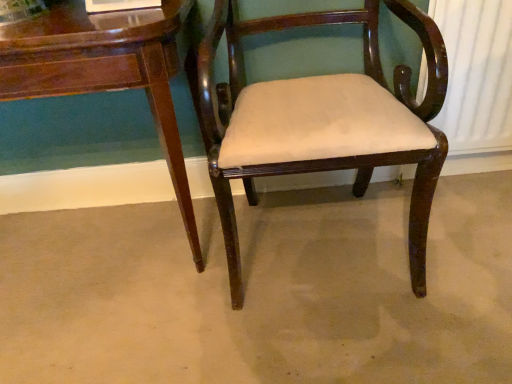
Question: From the image's perspective, is glossy wood table at lower left beneath mahogany wood chair at center?

Choices:
 (A) yes
 (B) no

Answer: (A)

Question: Considering the relative sizes of glossy wood table at lower left and mahogany wood chair at center in the image provided, is glossy wood table at lower left wider than mahogany wood chair at center?

Choices:
 (A) no
 (B) yes

Answer: (A)

Question: Is glossy wood table at lower left completely or partially outside of mahogany wood chair at center?

Choices:
 (A) no
 (B) yes

Answer: (B)

Question: Can you confirm if glossy wood table at lower left is shorter than mahogany wood chair at center?

Choices:
 (A) yes
 (B) no

Answer: (A)

Question: Does glossy wood table at lower left appear on the left side of mahogany wood chair at center?

Choices:
 (A) yes
 (B) no

Answer: (A)

Question: Is mahogany wood chair at center taller or shorter than glossy wood table at lower left?

Choices:
 (A) tall
 (B) short

Answer: (A)

Question: Choose the correct answer: Is mahogany wood chair at center inside glossy wood table at lower left or outside it?

Choices:
 (A) inside
 (B) outside

Answer: (B)

Question: Relative to glossy wood table at lower left, is mahogany wood chair at center in front or behind?

Choices:
 (A) behind
 (B) front

Answer: (B)

Question: Looking at the image, does mahogany wood chair at center seem bigger or smaller compared to glossy wood table at lower left?

Choices:
 (A) small
 (B) big

Answer: (A)

Question: In the image, is brown wood chair at center on the left side or the right side of mahogany wood chair at center?

Choices:
 (A) right
 (B) left

Answer: (B)

Question: Considering the positions of brown wood chair at center and mahogany wood chair at center in the image, is brown wood chair at center wider or thinner than mahogany wood chair at center?

Choices:
 (A) thin
 (B) wide

Answer: (B)

Question: In the image, is brown wood chair at center positioned in front of or behind mahogany wood chair at center?

Choices:
 (A) behind
 (B) front

Answer: (A)

Question: From a real-world perspective, is brown wood chair at center above or below mahogany wood chair at center?

Choices:
 (A) above
 (B) below

Answer: (B)

Question: From the image's perspective, is glossy wood table at lower left located above or below mahogany wood chair at center?

Choices:
 (A) below
 (B) above

Answer: (A)

Question: From a real-world perspective, is glossy wood table at lower left above or below mahogany wood chair at center?

Choices:
 (A) above
 (B) below

Answer: (B)